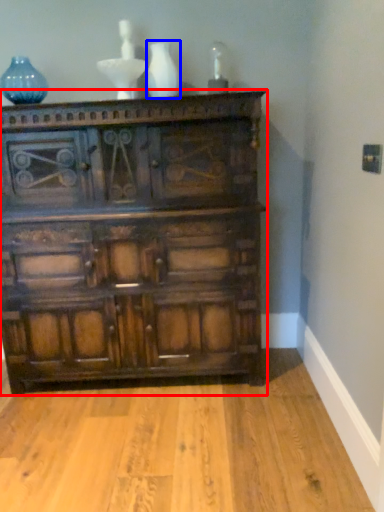
Question: Which object is further to the camera taking this photo, chest of drawers (highlighted by a red box) or vase (highlighted by a blue box)?

Choices:
 (A) chest of drawers
 (B) vase

Answer: (B)